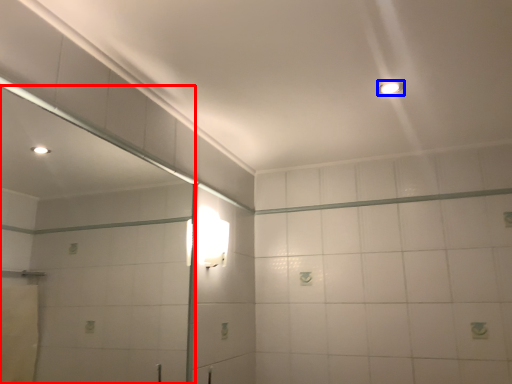
Question: Among these objects, which one is farthest to the camera, mirror (highlighted by a red box) or light fixture (highlighted by a blue box)?

Choices:
 (A) mirror
 (B) light fixture

Answer: (B)